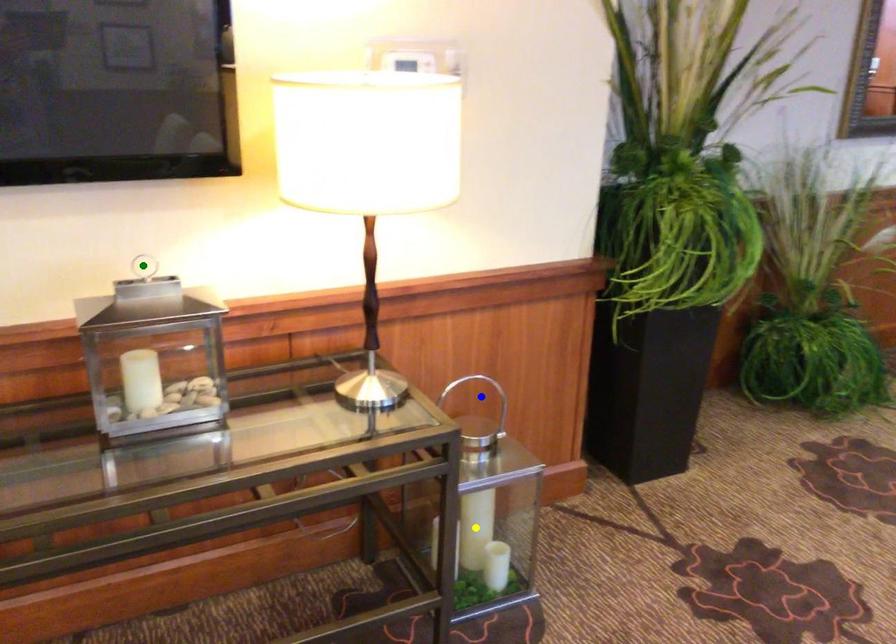
Order these from nearest to farthest:
A) blue point
B) green point
C) yellow point

green point < yellow point < blue point